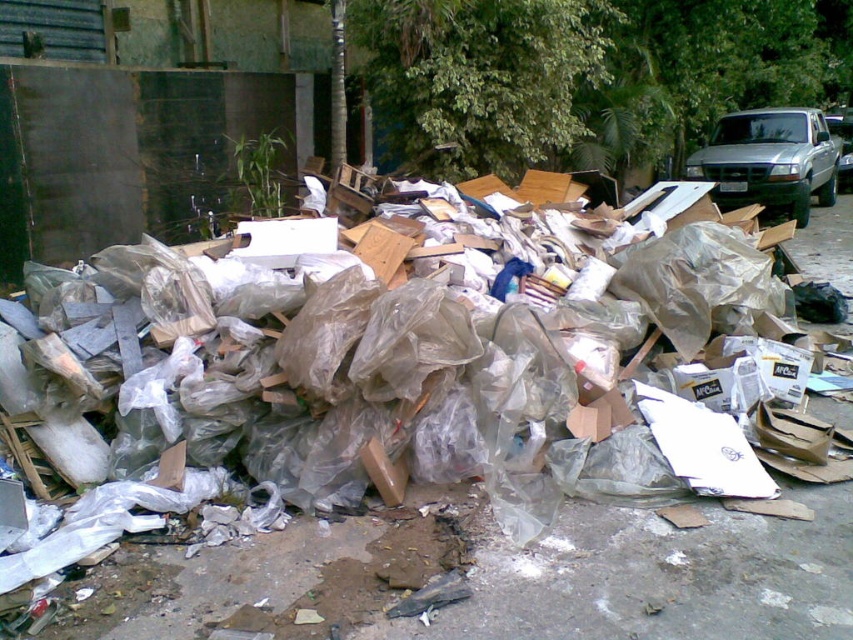
Question: Does translucent plastic debris at center have a greater width compared to silver metallic truck at upper right?

Choices:
 (A) no
 (B) yes

Answer: (B)

Question: Is translucent plastic debris at center thinner than silver metallic truck at upper right?

Choices:
 (A) no
 (B) yes

Answer: (A)

Question: Does translucent plastic debris at center appear over silver metallic truck at upper right?

Choices:
 (A) yes
 (B) no

Answer: (B)

Question: Which point is farther from the camera taking this photo?

Choices:
 (A) (804, 128)
 (B) (219, 577)

Answer: (A)

Question: Which point is farther from the camera taking this photo?

Choices:
 (A) (810, 109)
 (B) (817, 618)

Answer: (A)

Question: Which point is farther to the camera?

Choices:
 (A) (788, 120)
 (B) (805, 568)

Answer: (A)